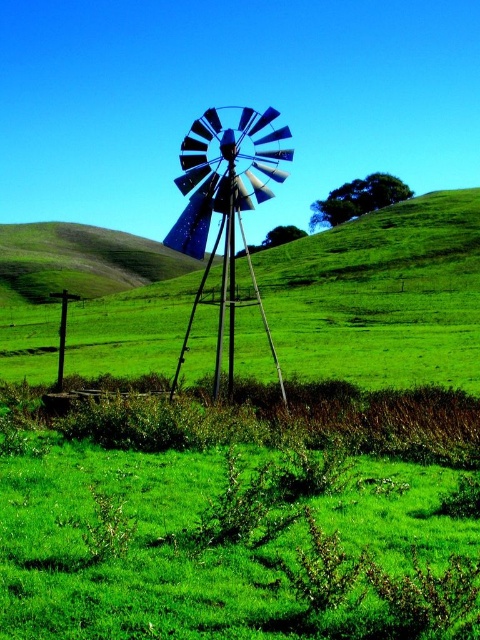
Question: Which of the following is the closest to the observer?

Choices:
 (A) (12, 268)
 (B) (75, 339)

Answer: (B)

Question: Is metallic windmill at center further to the viewer compared to blue metallic windmill at center?

Choices:
 (A) yes
 (B) no

Answer: (A)

Question: Which object appears farthest from the camera in this image?

Choices:
 (A) green grassy hillside at center
 (B) metallic windmill at center
 (C) blue metallic windmill at center

Answer: (A)

Question: Among these points, which one is farthest from the camera?

Choices:
 (A) (339, 272)
 (B) (126, 252)
 (C) (274, 115)

Answer: (B)

Question: Where is metallic windmill at center located in relation to green grassy hillside at center in the image?

Choices:
 (A) right
 (B) left

Answer: (A)

Question: Can you confirm if blue metallic windmill at center is positioned above green grassy hillside at center?

Choices:
 (A) yes
 (B) no

Answer: (B)